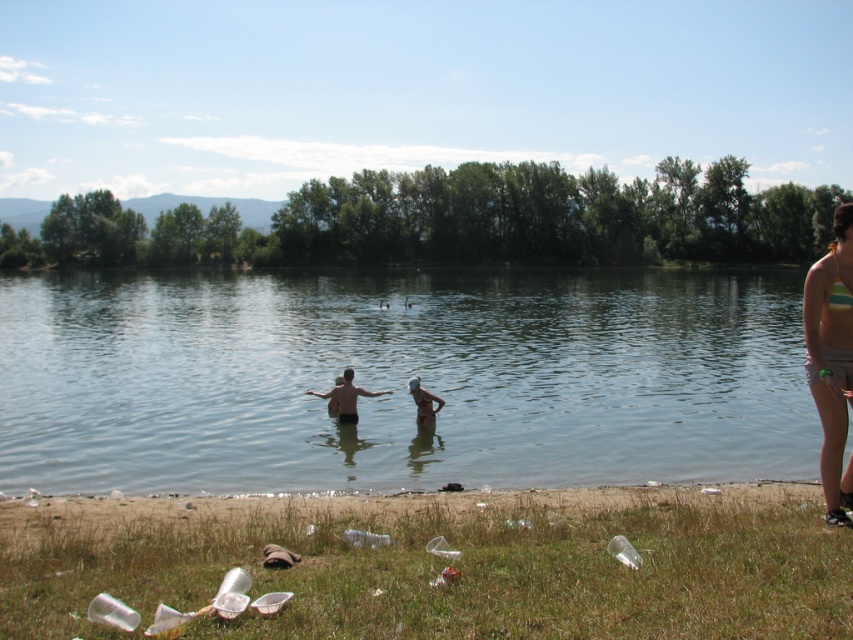
Question: Based on their relative distances, which object is nearer to the skinny white man at center?

Choices:
 (A) striped bikini top at lower right
 (B) clear water at center
 (C) white matte swim cap at upper center

Answer: (C)

Question: Can you confirm if clear water at center is positioned above white matte swim cap at upper center?

Choices:
 (A) no
 (B) yes

Answer: (B)

Question: Does clear water at center have a larger size compared to grassy shore at lower left?

Choices:
 (A) no
 (B) yes

Answer: (B)

Question: Is grassy shore at lower left behind white matte swim cap at upper center?

Choices:
 (A) yes
 (B) no

Answer: (B)

Question: Estimate the real-world distances between objects in this image. Which object is farther from the white matte swim cap at upper center?

Choices:
 (A) grassy shore at lower left
 (B) clear water at center
 (C) striped bikini top at lower right
 (D) skinny white man at center

Answer: (B)

Question: Which is farther from the skinny white man at center?

Choices:
 (A) clear water at center
 (B) grassy shore at lower left

Answer: (A)